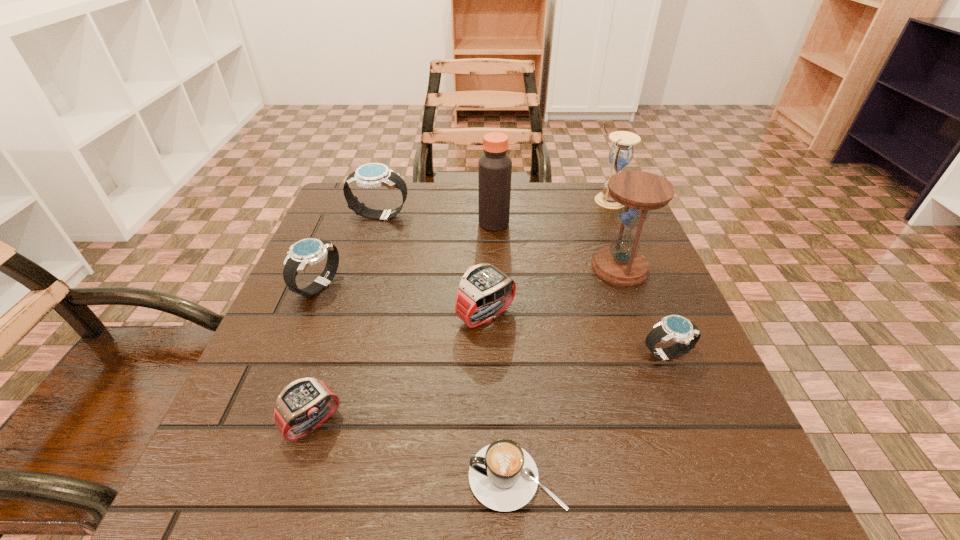
Where is `unoccupied area between the tallest watch and the farther red watch`? This screenshot has width=960, height=540. unoccupied area between the tallest watch and the farther red watch is located at coordinates (433, 265).

The width and height of the screenshot is (960, 540). Identify the location of free space between the second smallest silver watch and the farther hourglass. (464, 244).

Identify the location of free space that is in between the brown vinegar and the white hourglass. The width and height of the screenshot is (960, 540). (552, 212).

In order to click on empty space between the farther hourglass and the second nearest silver watch in this screenshot , I will do `click(464, 244)`.

What are the coordinates of `vacant space that is in between the biggest silver watch and the smaller red watch` in the screenshot? It's located at coord(347,319).

Find the location of a particular element. vacant area that lies between the biggest silver watch and the nearer hourglass is located at coordinates (500, 241).

Locate which object is the second closest to the farthest silver watch. Please provide its 2D coordinates. Your answer should be formatted as a tuple, i.e. [(x, y)], where the tuple contains the x and y coordinates of a point satisfying the conditions above.

[(494, 167)]

Locate an element on the screen. Image resolution: width=960 pixels, height=540 pixels. object that is the sixth closest one to the second nearest silver watch is located at coordinates (621, 263).

Where is `watch that stands as the second closest to the fourth tallest object`? This screenshot has height=540, width=960. watch that stands as the second closest to the fourth tallest object is located at coordinates (485, 292).

Identify which watch is the closest to the nearer hourglass. Please provide its 2D coordinates. Your answer should be formatted as a tuple, i.e. [(x, y)], where the tuple contains the x and y coordinates of a point satisfying the conditions above.

[(673, 327)]